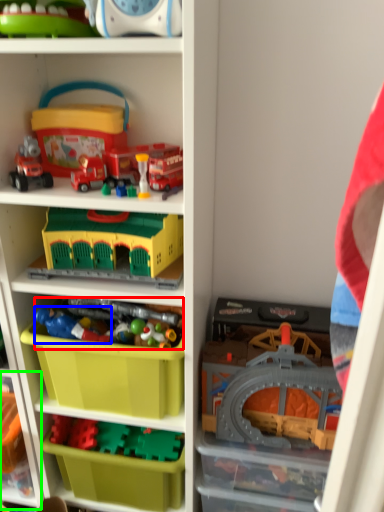
Question: Which object is positioned closest to toy (highlighted by a red box)? Select from toy (highlighted by a blue box) and shelf (highlighted by a green box).

Choices:
 (A) toy
 (B) shelf

Answer: (A)